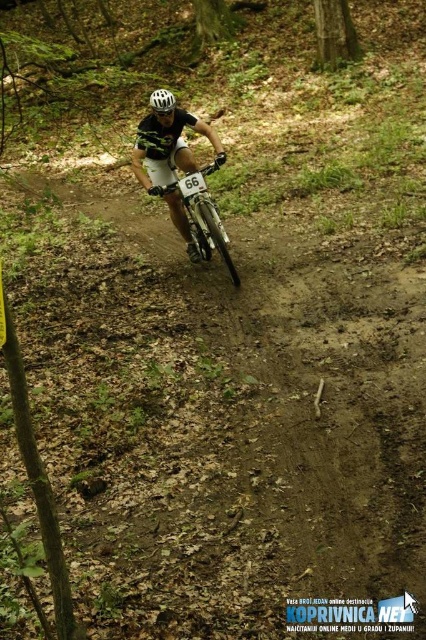
Question: Which of these objects is positioned farthest from the matte black helmet at center?

Choices:
 (A) shiny metallic bicycle at center
 (B) brown dirt track at center
 (C) white matte bicycle helmet at center

Answer: (B)

Question: Which object is farther from the camera taking this photo?

Choices:
 (A) brown dirt track at center
 (B) shiny metallic bicycle at center
 (C) matte black helmet at center
 (D) white matte bicycle helmet at center

Answer: (C)

Question: Among these points, which one is farthest from the camera?

Choices:
 (A) tap(172, 97)
 (B) tap(195, 166)
 (C) tap(207, 208)
 (D) tap(147, 264)

Answer: (D)

Question: Is brown dirt track at center wider than shiny metallic bicycle at center?

Choices:
 (A) no
 (B) yes

Answer: (A)

Question: Does brown dirt track at center have a smaller size compared to white matte bicycle helmet at center?

Choices:
 (A) yes
 (B) no

Answer: (A)

Question: Can you confirm if matte black helmet at center is positioned to the left of shiny metallic bicycle at center?

Choices:
 (A) yes
 (B) no

Answer: (A)